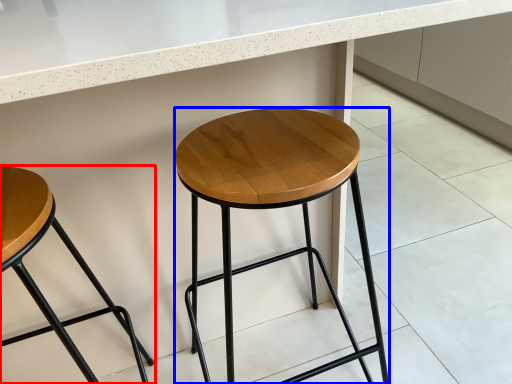
Question: Among these objects, which one is nearest to the camera, stool (highlighted by a red box) or stool (highlighted by a blue box)?

Choices:
 (A) stool
 (B) stool

Answer: (A)